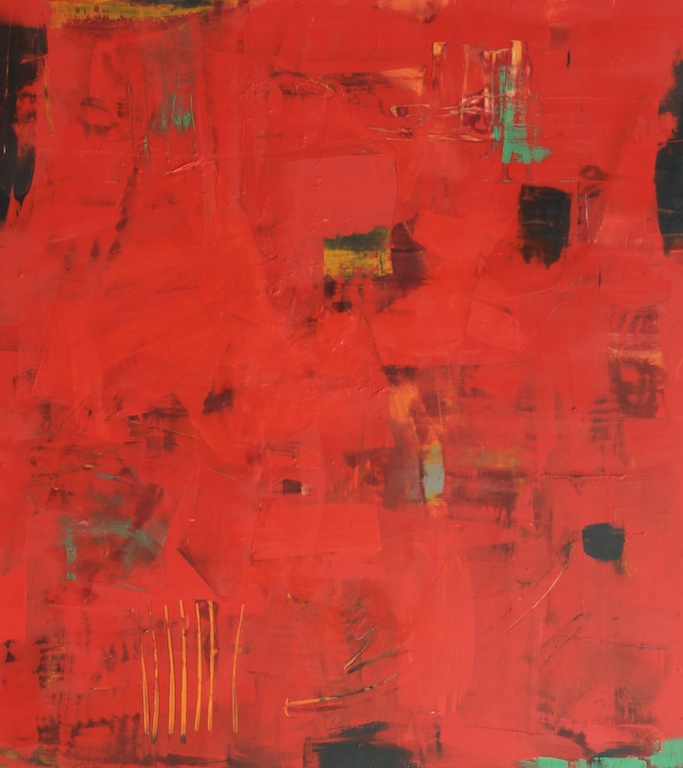
Locate an element on the screen. This screenshot has height=768, width=683. faces in the painting is located at coordinates (415, 137), (87, 149), (303, 187), (324, 487), (184, 455), (494, 399).